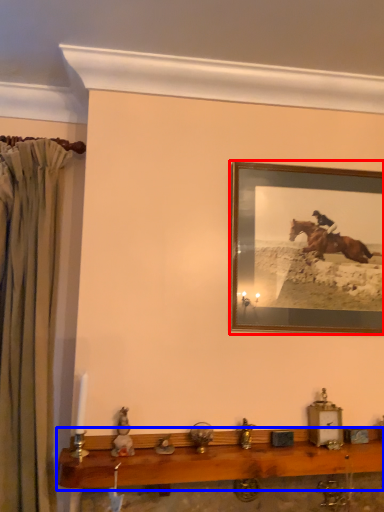
Question: Which point is closer to the camera, picture frame (highlighted by a red box) or table (highlighted by a blue box)?

Choices:
 (A) picture frame
 (B) table

Answer: (B)